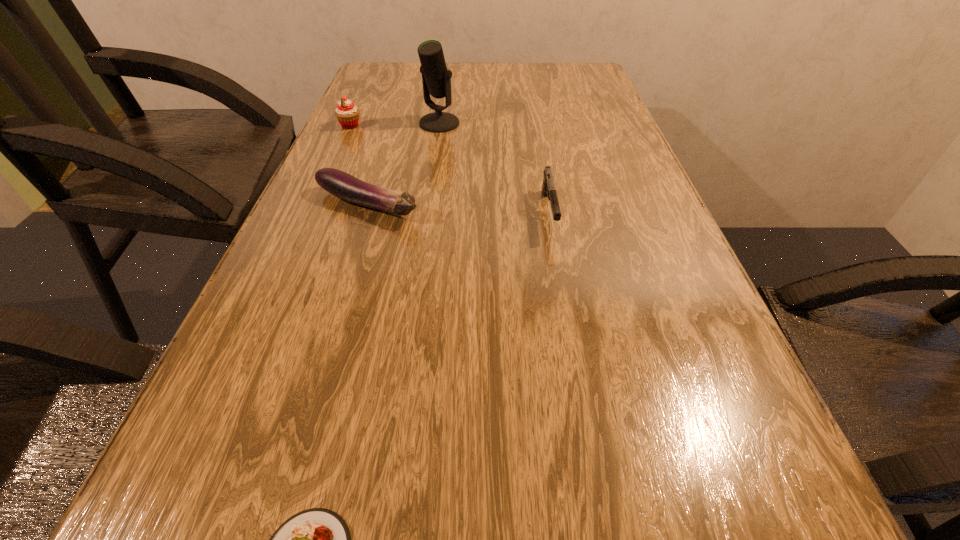
The height and width of the screenshot is (540, 960). In the image, there is a desktop. Find the location of `free space at the far edge`. free space at the far edge is located at coordinates (489, 91).

Locate an element on the screen. Image resolution: width=960 pixels, height=540 pixels. free space at the left edge of the desktop is located at coordinates (319, 341).

The width and height of the screenshot is (960, 540). Identify the location of blank space at the right edge of the desktop. (594, 122).

Locate an element on the screen. vacant area at the far left corner is located at coordinates (386, 62).

Locate an element on the screen. vacant space at the far right corner of the desktop is located at coordinates (x=583, y=76).

The image size is (960, 540). Identify the location of vacant area between the cupcake and the tallest object. (395, 125).

In order to click on vacant area between the microphone and the cupcake in this screenshot , I will do `click(395, 125)`.

Locate an element on the screen. empty location between the fourth shortest object and the tallest object is located at coordinates (395, 125).

The image size is (960, 540). I want to click on vacant region between the gun and the cupcake, so click(x=449, y=170).

Locate an element on the screen. Image resolution: width=960 pixels, height=540 pixels. vacant area that lies between the microphone and the gun is located at coordinates (494, 168).